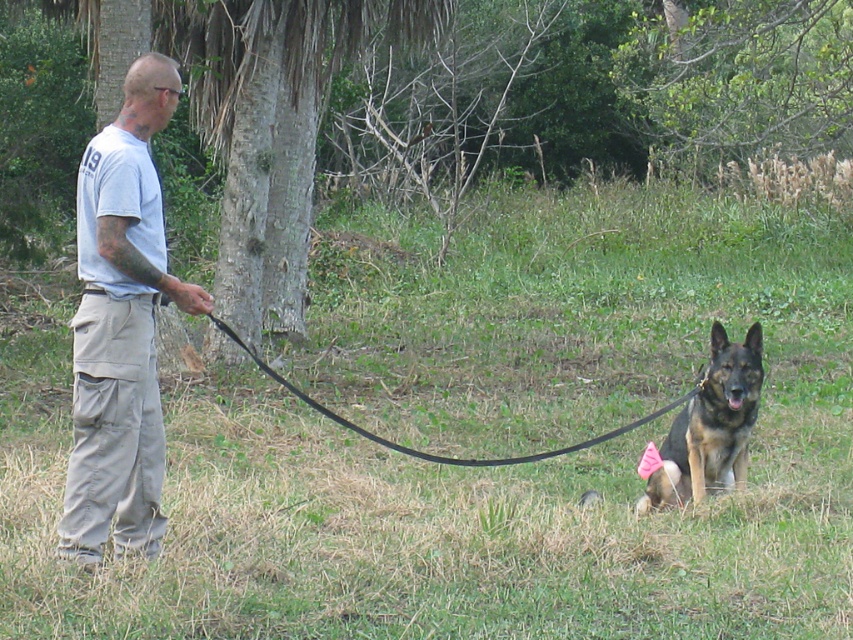
You are a drone operator tasked with capturing aerial footage of the green grass at center and the black rubber leash at center. The minimum distance required between the drone and the objects to maintain clear visibility is 8 meters. Can you fly the drone at a height where both objects remain in view without violating the distance requirement?

The green grass at center and black rubber leash at center are 8.59 meters apart. Since the minimum distance required is 8 meters, the drone can be flown at a height where both objects are within view as the distance between them meets the requirement.

You are a photographer trying to capture a clear shot of the black rubber leash at center without the green grass at center blocking it. What adjustment should you make to your camera angle?

The green grass at center is in front of the black rubber leash at center, so you should lower your camera angle to position the leash in front of the grass.